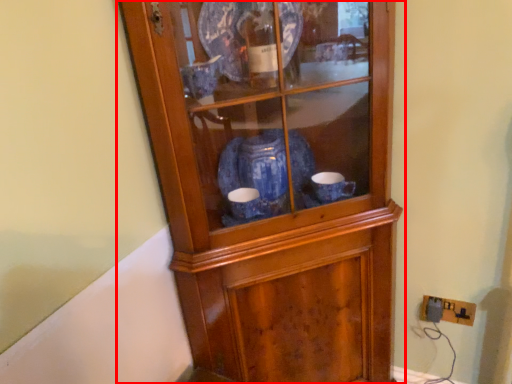
Question: Observing the image, what is the correct spatial positioning of cupboard (annotated by the red box) in reference to electric outlet?

Choices:
 (A) left
 (B) right

Answer: (A)